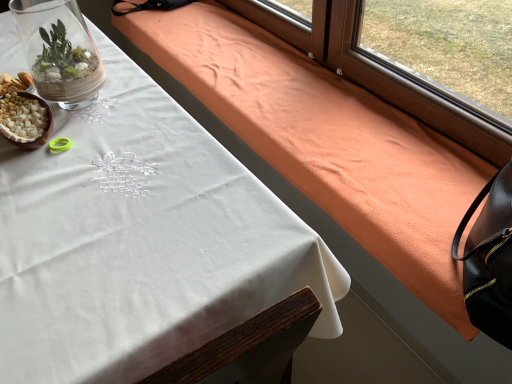
Locate an element on the screen. The width and height of the screenshot is (512, 384). vacant space to the right of clear glass terrarium at upper left is located at coordinates (142, 107).